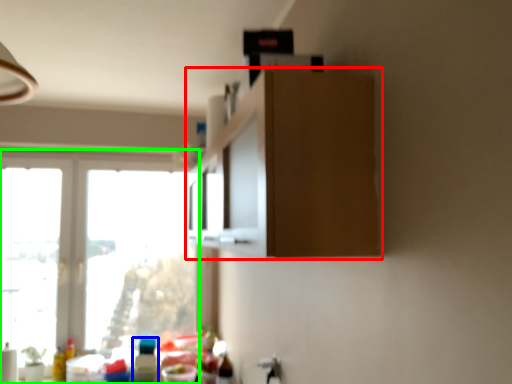
Question: Which object is the closest to the cabinetry (highlighted by a red box)? Choose among these: bottle (highlighted by a blue box) or window (highlighted by a green box).

Choices:
 (A) bottle
 (B) window

Answer: (A)